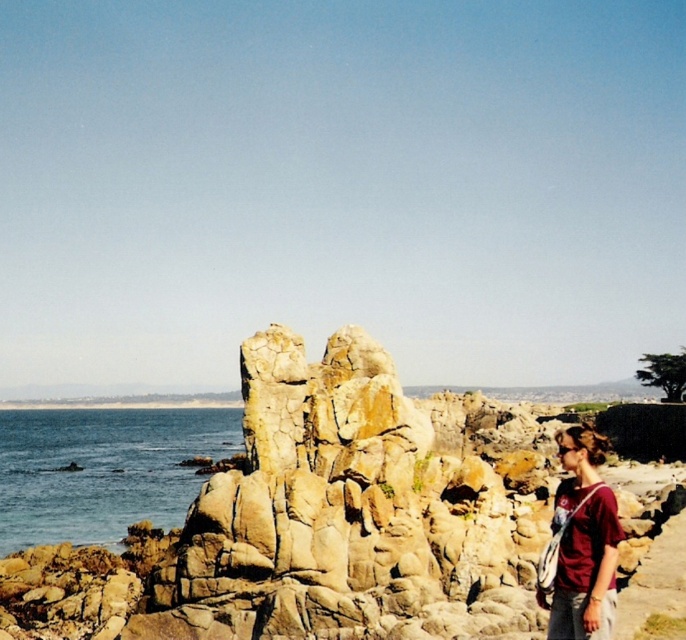
Can you confirm if blue water at left is positioned to the left of matte red shirt at lower right?

Yes, blue water at left is to the left of matte red shirt at lower right.

Who is more forward, (172, 445) or (556, 628)?

Point (556, 628) is in front.

Find the location of a particular element. This screenshot has height=640, width=686. blue water at left is located at coordinates (102, 470).